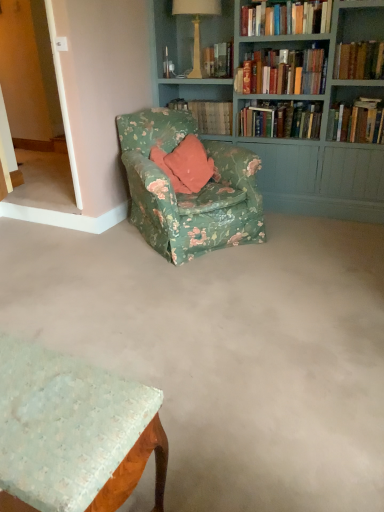
Question: Considering the positions of hardcover books at upper right, arranged as the fourth book when viewed from the left, and floral fabric table at lower left in the image, is hardcover books at upper right, arranged as the fourth book when viewed from the left, wider or thinner than floral fabric table at lower left?

Choices:
 (A) thin
 (B) wide

Answer: (A)

Question: From a real-world perspective, is hardcover books at upper right, arranged as the fourth book when viewed from the left, physically located above or below floral fabric table at lower left?

Choices:
 (A) above
 (B) below

Answer: (A)

Question: Which object is positioned farthest from the matte cream lamp at upper center?

Choices:
 (A) hardcover books at upper right, which is the first book from right to left
 (B) floral fabric book at center, which is the first book in left-to-right order
 (C) teal painted wood bookcase at upper right
 (D) hardcover book at upper right, which is the fifth book from left to right
 (E) hardcover books at upper right, which ranks as the third book in left-to-right order

Answer: (A)

Question: Estimate the real-world distances between objects in this image. Which object is closer to the hardcover books at upper right, which is counted as the third book, starting from the right?

Choices:
 (A) hardcover books at upper right, which is the first book from right to left
 (B) floral fabric table at lower left
 (C) floral fabric book at center, which is the sixth book from right to left
 (D) hardcover books at upper right, which ranks as the third book in left-to-right order
 (E) matte cream lamp at upper center

Answer: (A)